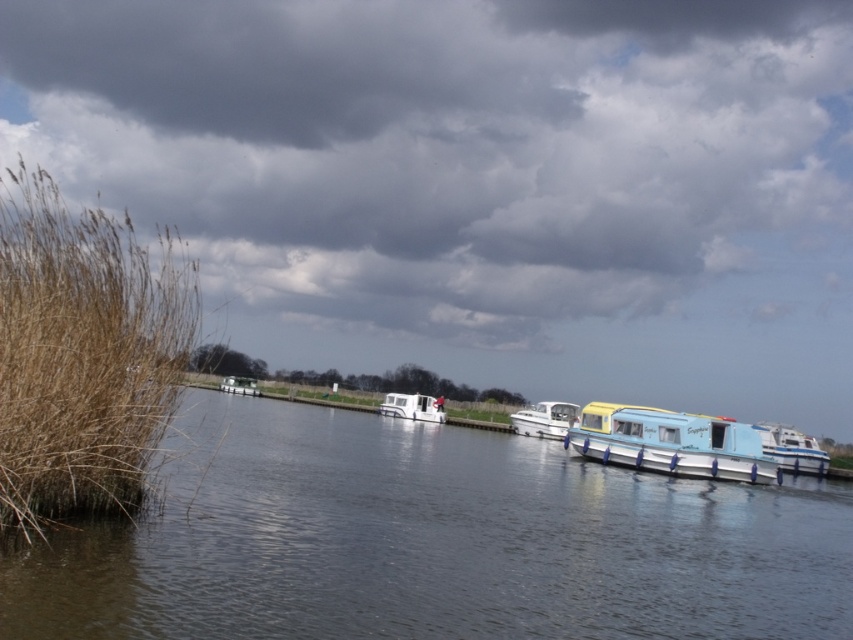
You are a boat owner who wants to move your boat from the white glossy boat at right to the white glossy boat at center. Considering the distance between them, can you safely navigate your boat through the narrow channel between them without hitting either boat?

The distance between the white glossy boat at right and the white glossy boat at center is 19.01 meters, which is sufficient for safe navigation. Your boat can easily pass through the channel without any collision risks.

You are standing on the riverside and want to board the closest boat. Which boat should you choose between the white glossy boat at right and the white glossy boat at center?

You should choose the white glossy boat at right because it is closer to the viewer than the white glossy boat at center.

You are standing at the riverside and want to take a photo of the cloudy sky at upper center and the white plastic boat at center. Which object should you focus on first to ensure it appears sharp in your photo?

You should focus on the cloudy sky at upper center first because it is closer to you than the white plastic boat at center, so capturing it sharply will also keep the boat in focus if they are in the same focal plane.